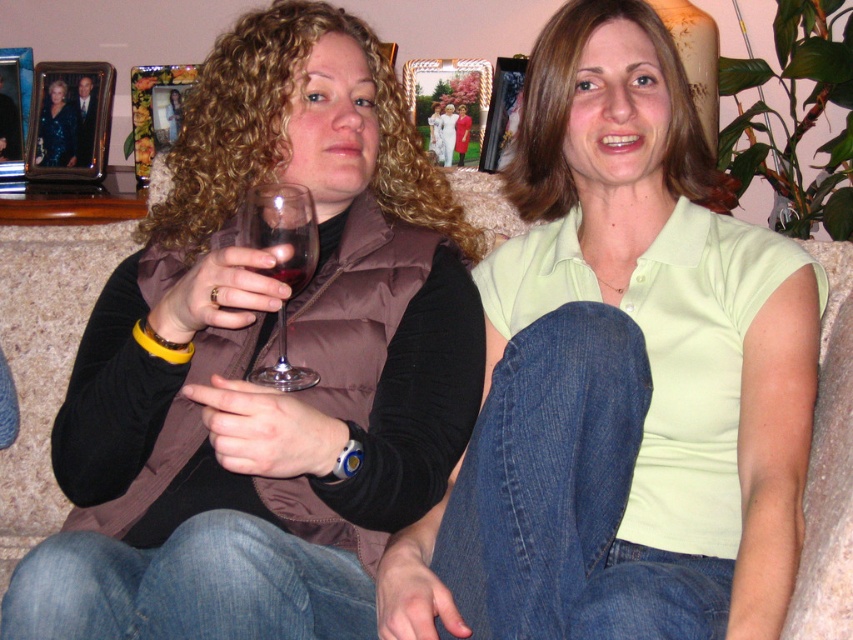
You are a photographer taking a picture of the scene. You notice the light green cotton shirt at center and the metallic photo frame at center. Which object should you focus on first if you want to capture both in the same frame without moving the camera? Explain your reasoning based on their positions.

You should focus on the metallic photo frame at center first because the light green cotton shirt at center is positioned to the right of it, ensuring both will be in the frame when centered on the frame.

You are standing at a point 2.09 meters away from the camera. You want to take a photo of the scene where the two people are sitting on the beige couch. Can you position yourself at point (51, 88) to capture the entire scene in your camera frame?

The point (51, 88) is 2.09 meters away from the camera. To capture the entire scene of the two people on the beige couch, you need to ensure that the camera is positioned at a distance where the entire scene fits within the frame. Since the question does not provide information about the camera frame size or the required distance for framing, it is impossible to determine if positioning at that point will work. However, the point is exactly 2.09 meters from the camera, which may or may not be suitable.

You are a photographer trying to capture a closeup of the transparent glass at center without the brushed metal picture frame at upper left appearing in the shot. Is this possible given their positions?

The transparent glass at center is positioned under the brushed metal picture frame at upper left, so moving the camera lower might allow capturing the transparent glass at center without the frame obstructing the view.